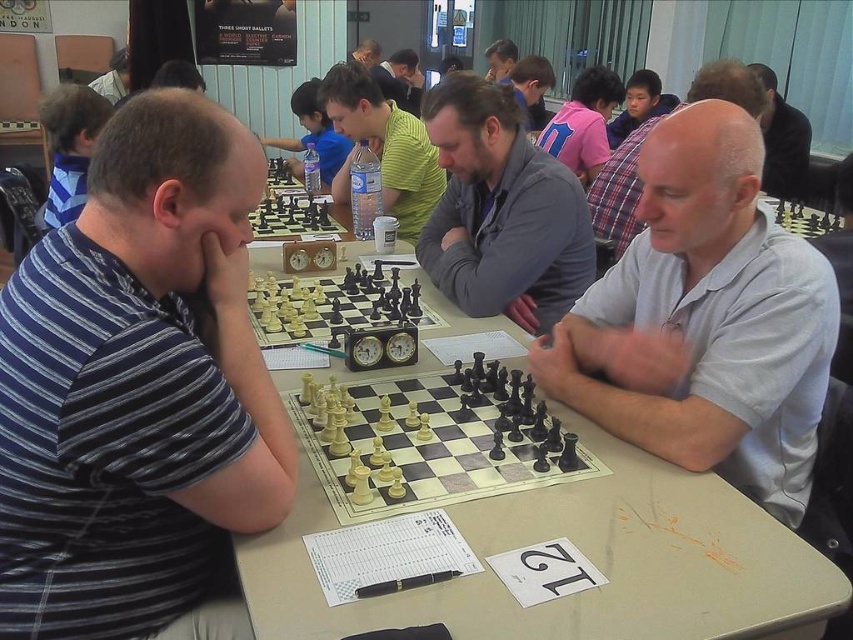
You are a robot with a 1.2 meter arm reach. You need to pick up the wooden chess set at center from the table. Can you reach it while standing where the bald white shirt at center is seated?

The distance between the bald white shirt at center and the wooden chess set at center is 1.24 meters. Since your arm can reach 1.2 meters, you cannot reach the wooden chess set at center from that position.

In the scene shown: You are a photographer standing at the back of the room. You want to take a photo of both the striped cotton shirt at left and the green striped shirt at center in the same frame. The camera you are using has a maximum focus range of 1.5 meters. Will both shirts be in focus?

The distance between the striped cotton shirt at left and the green striped shirt at center is 1.75 meters. Since the camera can only focus within 1.5 meters, the shirts are too far apart to be in focus simultaneously.